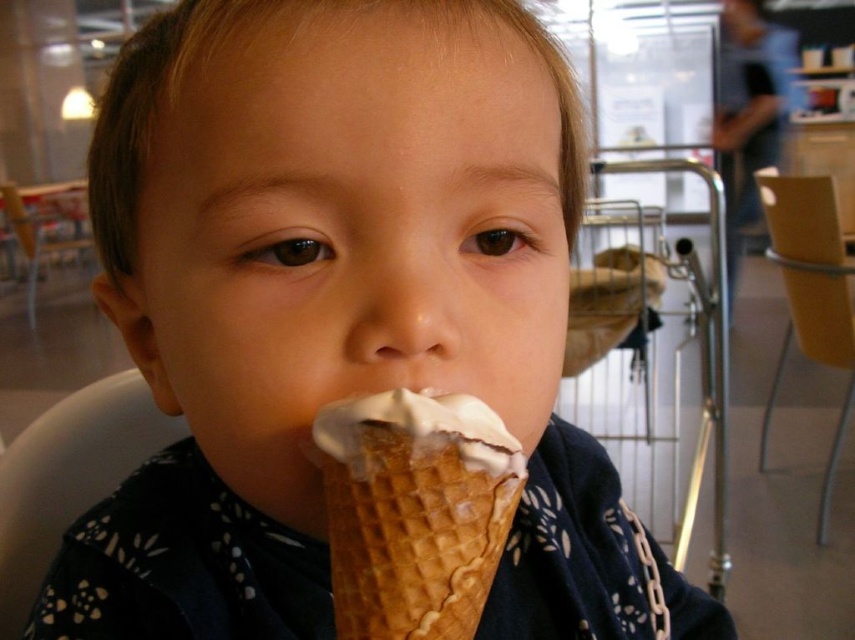
Is waffle cone ice cream at mouth above yellow plastic chair at right?

No, waffle cone ice cream at mouth is not above yellow plastic chair at right.

Can you confirm if waffle cone ice cream at mouth is wider than yellow plastic chair at right?

Incorrect, waffle cone ice cream at mouth's width does not surpass yellow plastic chair at right's.

Find the location of a particular element. The image size is (855, 640). waffle cone ice cream at mouth is located at coordinates (416, 512).

Based on the photo, does white plastic chair at lower left appear over yellow plastic chair at right?

No, white plastic chair at lower left is not above yellow plastic chair at right.

Does point (108, 465) come in front of point (759, 173)?

Yes, it is.

You are a GUI agent. You are given a task and a screenshot of the screen. Output one action in this format:
    pyautogui.click(x=<x>, y=<y>)
    Task: Click on the white plastic chair at lower left
    This screenshot has height=640, width=855.
    Given the screenshot: What is the action you would take?
    pyautogui.click(x=68, y=476)

Which is more to the right, yellow plastic chair at right or brown leather chair at left?

yellow plastic chair at right is more to the right.

Is yellow plastic chair at right further to camera compared to brown leather chair at left?

No, yellow plastic chair at right is in front of brown leather chair at left.

Locate an element on the screen. yellow plastic chair at right is located at coordinates (811, 296).